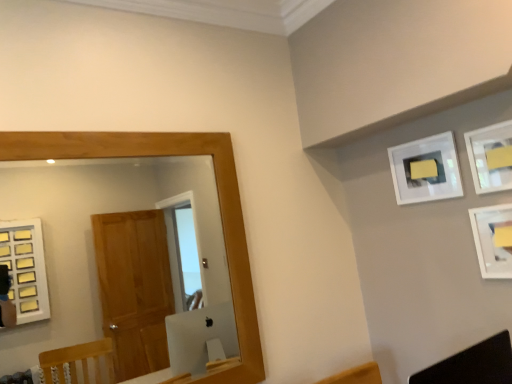
Question: Can you confirm if black leather swivel chair at lower right is positioned to the right of white matte picture frame at upper right, the 3th picture frame positioned from the back?

Choices:
 (A) yes
 (B) no

Answer: (B)

Question: Does black leather swivel chair at lower right appear on the left side of white matte picture frame at upper right, the 3th picture frame positioned from the back?

Choices:
 (A) yes
 (B) no

Answer: (A)

Question: Considering the relative sizes of black leather swivel chair at lower right and white matte picture frame at upper right, the 1th picture frame from the front, in the image provided, is black leather swivel chair at lower right thinner than white matte picture frame at upper right, the 1th picture frame from the front,?

Choices:
 (A) no
 (B) yes

Answer: (A)

Question: Is black leather swivel chair at lower right facing away from white matte picture frame at upper right, the 1th picture frame from the front?

Choices:
 (A) no
 (B) yes

Answer: (A)

Question: Is black leather swivel chair at lower right wider than white matte picture frame at upper right, the 3th picture frame positioned from the back?

Choices:
 (A) no
 (B) yes

Answer: (B)

Question: Is black leather swivel chair at lower right behind white matte picture frame at upper right, the 3th picture frame positioned from the back?

Choices:
 (A) no
 (B) yes

Answer: (A)

Question: Is wooden-framed mirror at left at the left side of white matte picture frame at upper right, acting as the 3th picture frame starting from the front?

Choices:
 (A) yes
 (B) no

Answer: (A)

Question: From the image's perspective, is wooden-framed mirror at left on top of white matte picture frame at upper right, acting as the 3th picture frame starting from the front?

Choices:
 (A) yes
 (B) no

Answer: (B)

Question: Considering the relative sizes of wooden-framed mirror at left and white matte picture frame at upper right, placed as the 1th picture frame when sorted from back to front, in the image provided, is wooden-framed mirror at left thinner than white matte picture frame at upper right, placed as the 1th picture frame when sorted from back to front,?

Choices:
 (A) no
 (B) yes

Answer: (A)

Question: Would you say white matte picture frame at upper right, placed as the 1th picture frame when sorted from back to front, is part of wooden-framed mirror at left's contents?

Choices:
 (A) yes
 (B) no

Answer: (B)

Question: Are wooden-framed mirror at left and white matte picture frame at upper right, placed as the 1th picture frame when sorted from back to front, located far from each other?

Choices:
 (A) yes
 (B) no

Answer: (A)

Question: From the image's perspective, is wooden-framed mirror at left located beneath white matte picture frame at upper right, acting as the 3th picture frame starting from the front?

Choices:
 (A) yes
 (B) no

Answer: (A)

Question: From a real-world perspective, is black leather swivel chair at lower right positioned under matte white picture frame at upper right, the 2th picture frame in the back-to-front sequence, based on gravity?

Choices:
 (A) no
 (B) yes

Answer: (B)